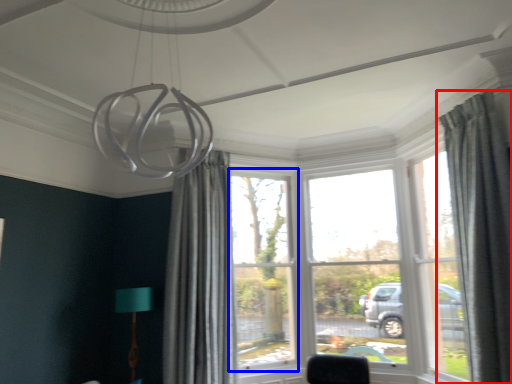
Question: Which of the following is the closest to the observer, curtain (highlighted by a red box) or window (highlighted by a blue box)?

Choices:
 (A) curtain
 (B) window

Answer: (A)